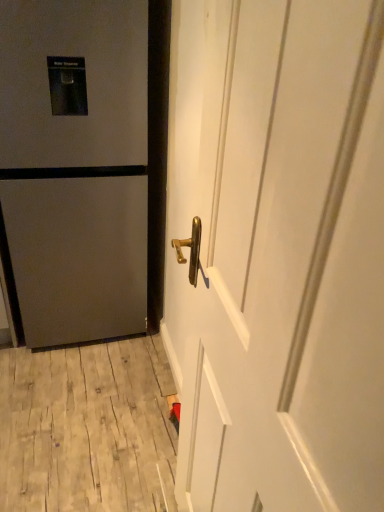
Question: Is wooden at lower left bigger or smaller than matte gray refrigerator at left, the first door viewed from the left?

Choices:
 (A) big
 (B) small

Answer: (B)

Question: From the image's perspective, relative to matte gray refrigerator at left, which is the 1th door in back-to-front order, is wooden at lower left above or below?

Choices:
 (A) above
 (B) below

Answer: (B)

Question: Which object is positioned farthest from the white glossy door handle at center, which is counted as the 2th door, starting from the left?

Choices:
 (A) matte gray refrigerator at left, the first door viewed from the left
 (B) wooden at lower left

Answer: (B)

Question: Based on their relative distances, which object is nearer to the white glossy door handle at center, acting as the second door starting from the back?

Choices:
 (A) matte gray refrigerator at left, the 2th door from the right
 (B) wooden at lower left

Answer: (A)